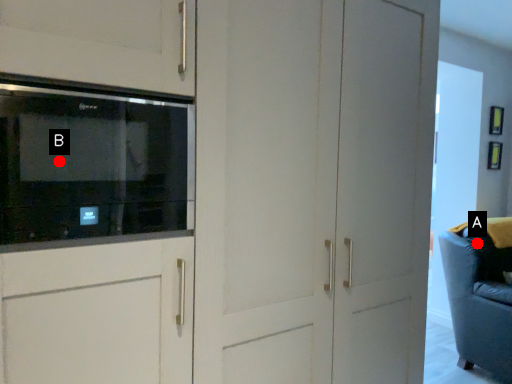
Question: Two points are circled on the image, labeled by A and B beside each circle. Which of the following is the farthest from the observer?

Choices:
 (A) A is further
 (B) B is further

Answer: (A)